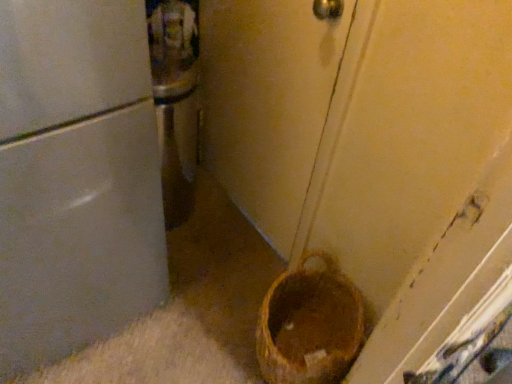
Question: Considering the relative sizes of matte white door at center and brown woven basket at lower right in the image provided, is matte white door at center thinner than brown woven basket at lower right?

Choices:
 (A) yes
 (B) no

Answer: (B)

Question: Considering the relative sizes of matte white door at center and brown woven basket at lower right in the image provided, is matte white door at center taller than brown woven basket at lower right?

Choices:
 (A) no
 (B) yes

Answer: (B)

Question: Is matte white door at center to the right of brown woven basket at lower right from the viewer's perspective?

Choices:
 (A) yes
 (B) no

Answer: (B)

Question: From the image's perspective, is matte white door at center above brown woven basket at lower right?

Choices:
 (A) yes
 (B) no

Answer: (A)

Question: Is matte white door at center bigger than brown woven basket at lower right?

Choices:
 (A) yes
 (B) no

Answer: (A)

Question: Could you tell me if matte white door at center is turned towards brown woven basket at lower right?

Choices:
 (A) yes
 (B) no

Answer: (B)

Question: Is brown woven basket at lower right shorter than matte white door at center?

Choices:
 (A) yes
 (B) no

Answer: (A)

Question: Is brown woven basket at lower right facing away from matte white door at center?

Choices:
 (A) no
 (B) yes

Answer: (A)

Question: Is brown woven basket at lower right oriented towards matte white door at center?

Choices:
 (A) yes
 (B) no

Answer: (B)

Question: Is brown woven basket at lower right taller than matte white door at center?

Choices:
 (A) no
 (B) yes

Answer: (A)

Question: From a real-world perspective, is brown woven basket at lower right on top of matte white door at center?

Choices:
 (A) yes
 (B) no

Answer: (B)

Question: From the image's perspective, would you say brown woven basket at lower right is positioned over matte white door at center?

Choices:
 (A) yes
 (B) no

Answer: (B)

Question: In terms of height, does brown woven basket at lower right look taller or shorter compared to matte white door at center?

Choices:
 (A) tall
 (B) short

Answer: (B)